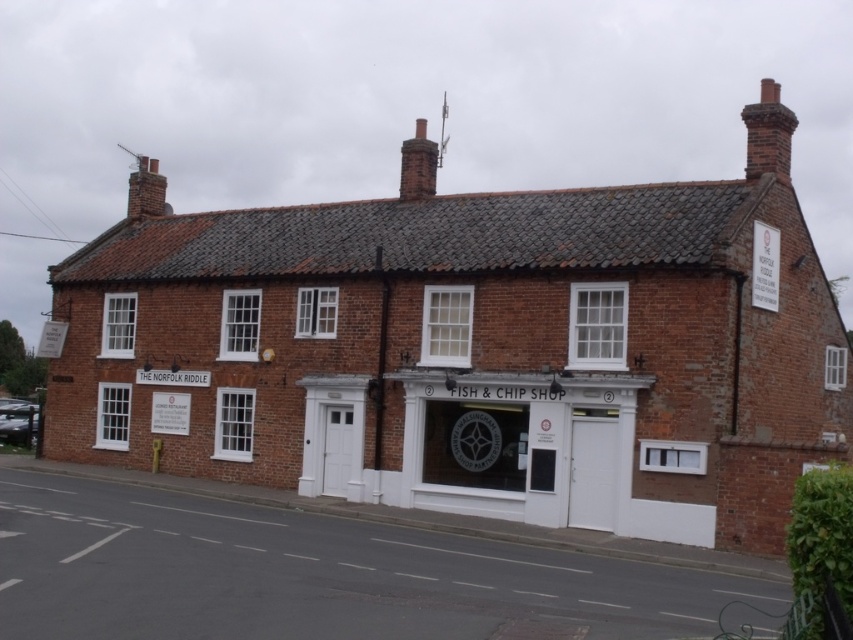
Question: Among these objects, which one is farthest from the camera?

Choices:
 (A) red brick chimney at upper right
 (B) red brick chimney at center
 (C) brick chimney at upper left

Answer: (C)

Question: Which of the following is the farthest from the observer?

Choices:
 (A) red brick chimney at upper right
 (B) red brick chimney at center
 (C) brick chimney at upper center

Answer: (B)

Question: Can you confirm if red brick chimney at center is thinner than brick chimney at upper left?

Choices:
 (A) yes
 (B) no

Answer: (A)

Question: Can you confirm if red brick chimney at center is wider than brick chimney at upper left?

Choices:
 (A) no
 (B) yes

Answer: (A)

Question: Considering the relative positions of red brick chimney at upper right and brick chimney at upper left in the image provided, where is red brick chimney at upper right located with respect to brick chimney at upper left?

Choices:
 (A) left
 (B) right

Answer: (B)

Question: Estimate the real-world distances between objects in this image. Which object is farther from the red brick chimney at center?

Choices:
 (A) brick chimney at upper center
 (B) brick chimney at upper left
 (C) red brick chimney at upper right

Answer: (C)